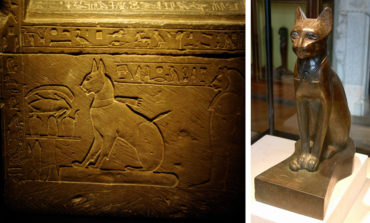
This screenshot has width=370, height=223. What are the coordinates of `glass` in the screenshot? It's located at (280, 63), (262, 67).